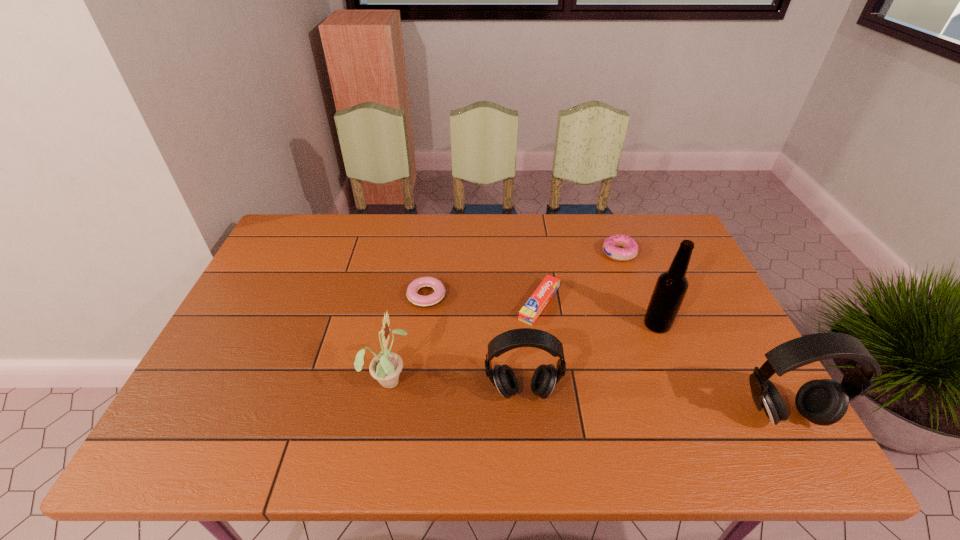
You are a GUI agent. You are given a task and a screenshot of the screen. Output one action in this format:
    pyautogui.click(x=<x>, y=<y>)
    Task: Click on the vacant region located on the front of the farthest object
    
    Given the screenshot: What is the action you would take?
    pyautogui.click(x=630, y=281)

This screenshot has height=540, width=960. In order to click on vacant space located on the back of the shorter doughnut in this screenshot , I will do `click(431, 260)`.

I want to click on vacant area located 0.080m on the front of the beer bottle, so click(x=671, y=360).

Locate an element on the screen. free space located on the front-facing side of the sunflower is located at coordinates (439, 379).

Where is `vacant area situated 0.090m on the back of the toothpaste`? Image resolution: width=960 pixels, height=540 pixels. vacant area situated 0.090m on the back of the toothpaste is located at coordinates (534, 263).

The height and width of the screenshot is (540, 960). I want to click on object that is positioned at the far edge, so click(x=629, y=248).

This screenshot has width=960, height=540. What are the coordinates of `sunflower located at the near edge` in the screenshot? It's located at (385, 367).

At what (x,y) coordinates should I click in order to perform the action: click on earphone located in the right edge section of the desktop. Please return your answer as a coordinate pair (x, y). The image size is (960, 540). Looking at the image, I should click on coord(823,402).

At what (x,y) coordinates should I click in order to perform the action: click on beer bottle that is at the right edge. Please return your answer as a coordinate pair (x, y). The width and height of the screenshot is (960, 540). Looking at the image, I should click on (670, 289).

This screenshot has width=960, height=540. Find the location of `object that is positioned at the near right corner`. object that is positioned at the near right corner is located at coordinates (823, 402).